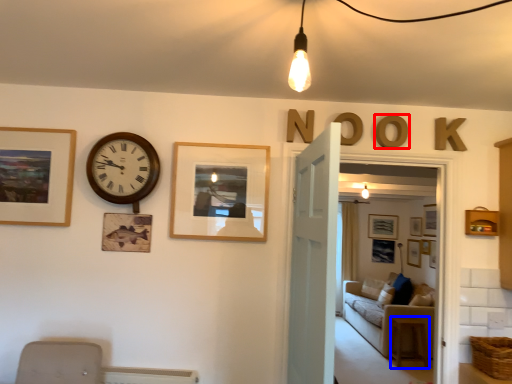
Question: Which object appears closest to the camera in this image, letter (highlighted by a red box) or changing table (highlighted by a blue box)?

Choices:
 (A) letter
 (B) changing table

Answer: (A)